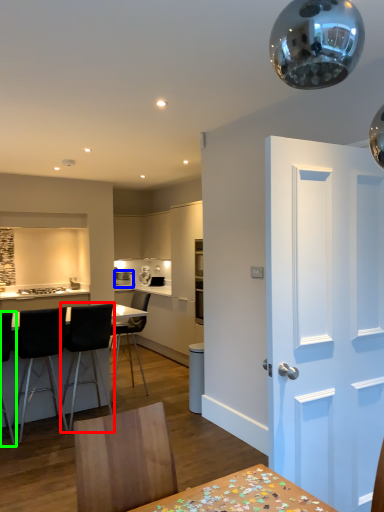
Question: Which is nearer to the chair (highlighted by a red box)? appliance (highlighted by a blue box) or chair (highlighted by a green box).

Choices:
 (A) appliance
 (B) chair

Answer: (B)